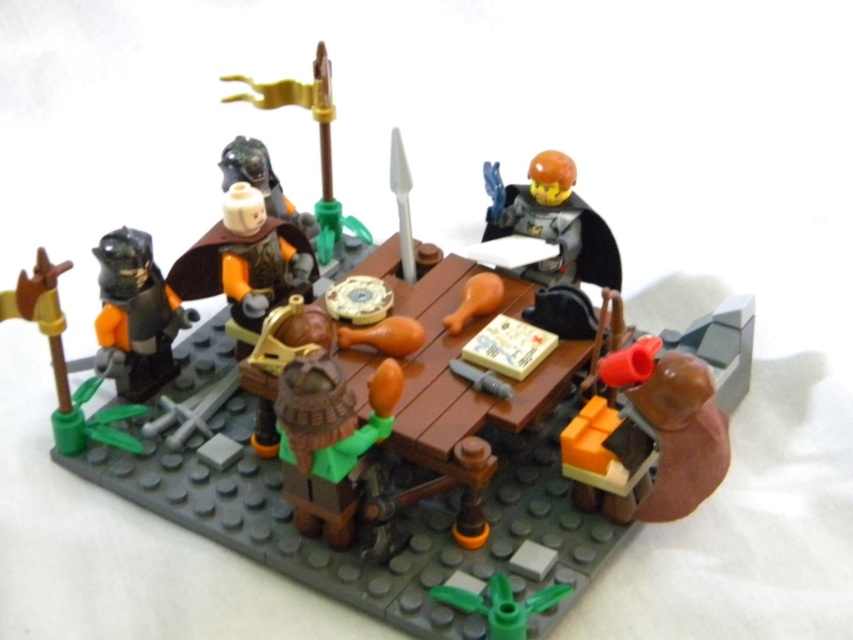
You are a knight in the LEGO scene. You see the brown matte helmet at center and the smooth orange cape at center. Which item is nearer to you?

The brown matte helmet at center is closer to the viewer than the smooth orange cape at center.